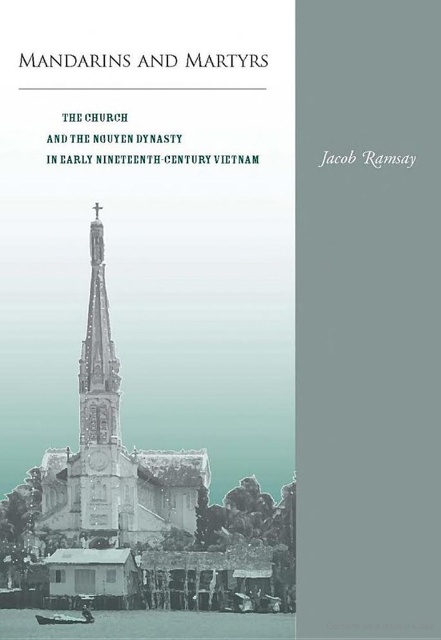
Question: Which object is positioned farthest from the clear water at lower center?

Choices:
 (A) stone church steeple at center
 (B) wooden boat at lower left

Answer: (A)

Question: Which point is farther to the camera?

Choices:
 (A) clear water at lower center
 (B) wooden boat at lower left
 (C) stone church steeple at center

Answer: (C)

Question: Is stone church steeple at center further to camera compared to wooden boat at lower left?

Choices:
 (A) no
 (B) yes

Answer: (B)

Question: Is clear water at lower center to the right of wooden boat at lower left from the viewer's perspective?

Choices:
 (A) no
 (B) yes

Answer: (B)

Question: Does clear water at lower center have a smaller size compared to wooden boat at lower left?

Choices:
 (A) no
 (B) yes

Answer: (A)

Question: Which of the following is the closest to the observer?

Choices:
 (A) wooden boat at lower left
 (B) stone church steeple at center

Answer: (A)